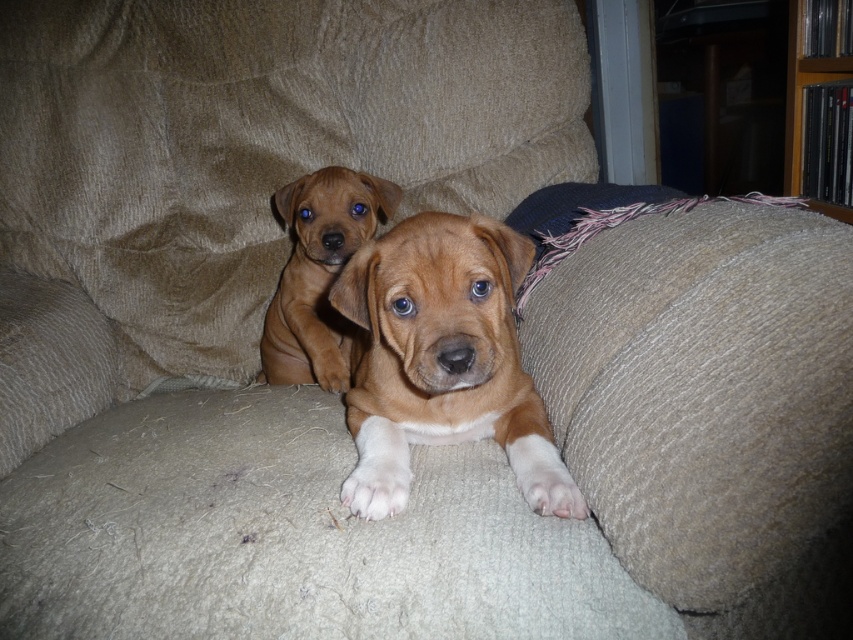
Question: Is brown furry puppy at center below wooden bookshelf at upper right?

Choices:
 (A) no
 (B) yes

Answer: (B)

Question: Estimate the real-world distances between objects in this image. Which object is farther from the wooden bookshelf at upper right?

Choices:
 (A) sandy fur puppy at center
 (B) dark blue textured pillow at right

Answer: (A)

Question: Which object is the farthest from the dark blue textured pillow at right?

Choices:
 (A) brown furry puppy at center
 (B) wooden bookshelf at upper right

Answer: (B)

Question: Which of the following is the farthest from the observer?

Choices:
 (A) brown furry puppy at center
 (B) dark blue textured pillow at right

Answer: (A)

Question: Is dark blue textured pillow at right thinner than sandy fur puppy at center?

Choices:
 (A) yes
 (B) no

Answer: (B)

Question: Does brown furry puppy at center have a smaller size compared to wooden bookshelf at upper right?

Choices:
 (A) yes
 (B) no

Answer: (B)